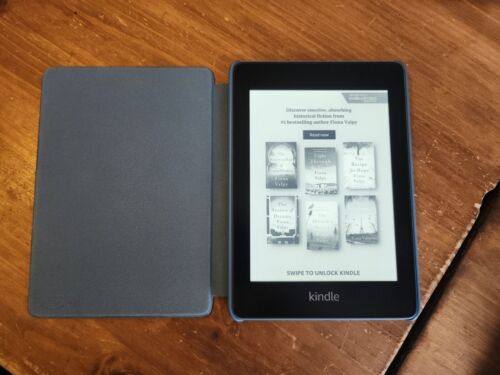
Where is `shadow from wooden tabletop`? The width and height of the screenshot is (500, 375). shadow from wooden tabletop is located at coordinates (478, 227).